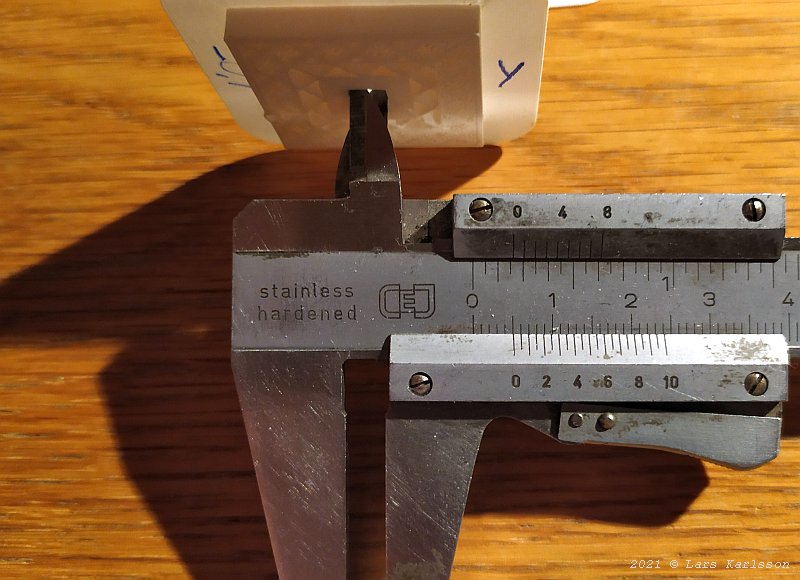
You are a GUI agent. You are given a task and a screenshot of the screen. Output one action in this format:
    pyautogui.click(x=<x>, y=<y>)
    Task: Click on the table surface
    Image resolution: width=800 pixels, height=580 pixels.
    Given the screenshot: What is the action you would take?
    pyautogui.click(x=94, y=463)